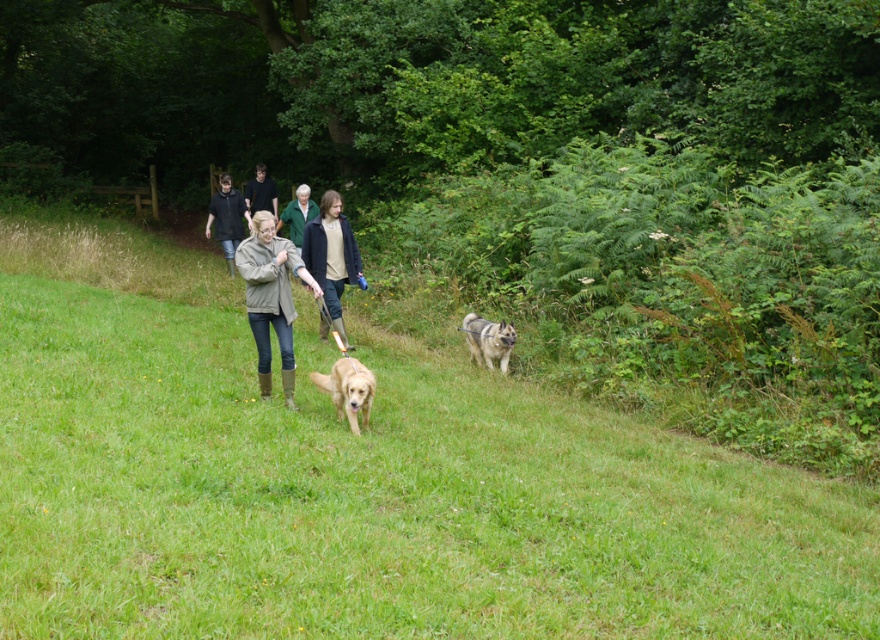
Consider the image. You are standing at point (299, 243) and want to walk towards point (480, 316). Based on the scene description, will you be moving towards the foreground or the background of the image?

Point (480, 316) is in front of point (299, 243). Since you are moving towards the foreground, you will be heading towards the area where the two individuals and their dogs are located, which is closer to the viewer.

You are a photographer standing at the camera position. You want to capture a close shot of the shiny brown fur at center. Given that your camera can focus on objects within 30 feet, will you need to adjust your position to get a clear photo?

The shiny brown fur at center is 33.06 feet away from the camera. Since this distance exceeds the camera focus range of 30 feet, you need to move closer to ensure the shiny brown fur at center is within the 30 feet focus range for a clear photo.